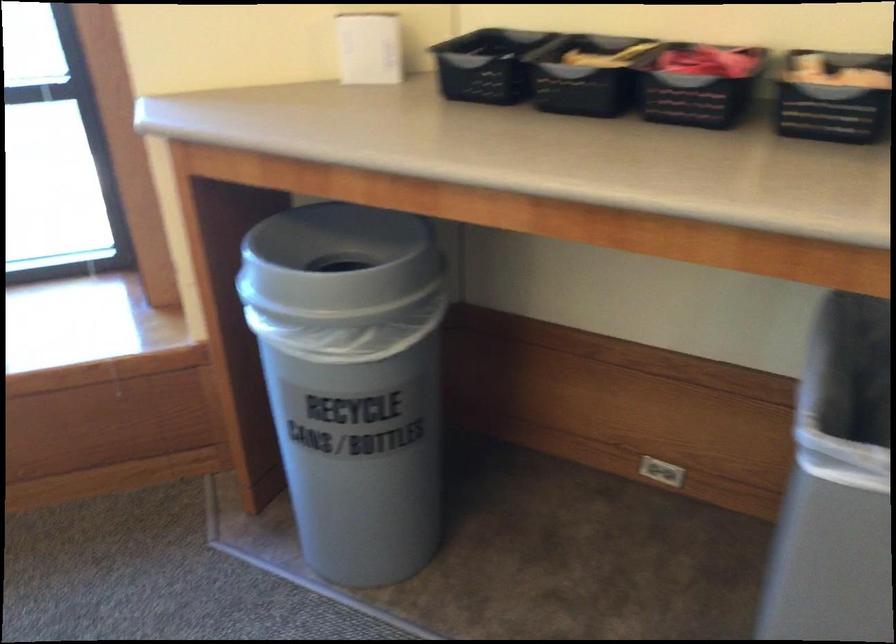
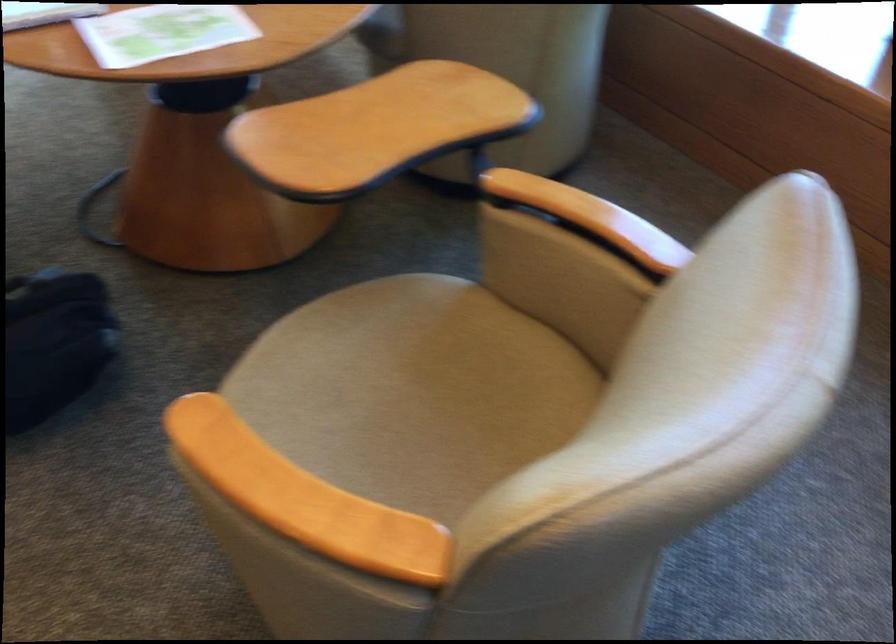
The first image is from the beginning of the video and the second image is from the end. How did the camera likely rotate when shooting the video?

The camera rotated toward left-down.